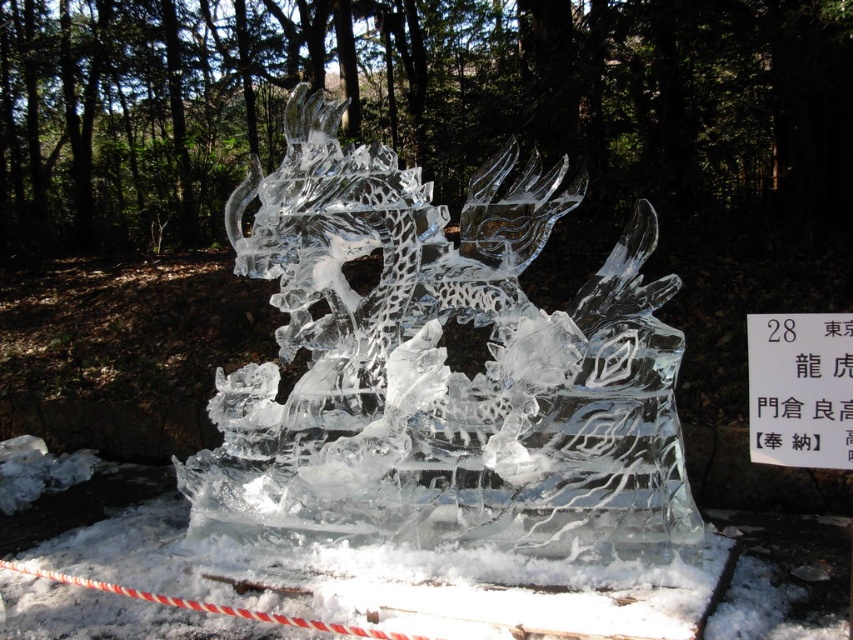
Question: Which point appears closest to the camera in this image?

Choices:
 (A) (120, 589)
 (B) (782, 317)
 (C) (488, 289)

Answer: (B)

Question: Which of the following is the farthest from the observer?

Choices:
 (A) transparent ice dragon at center
 (B) white paper at center

Answer: (A)

Question: Can you confirm if transparent ice dragon at center is positioned above white paper at center?

Choices:
 (A) yes
 (B) no

Answer: (A)

Question: Which object appears farthest from the camera in this image?

Choices:
 (A) transparent ice dragon at center
 (B) transparent ice sculpture at center

Answer: (A)

Question: Observing the image, what is the correct spatial positioning of transparent ice dragon at center in reference to transparent ice sculpture at center?

Choices:
 (A) right
 (B) left

Answer: (A)

Question: Is transparent ice dragon at center positioned before transparent ice sculpture at center?

Choices:
 (A) no
 (B) yes

Answer: (A)